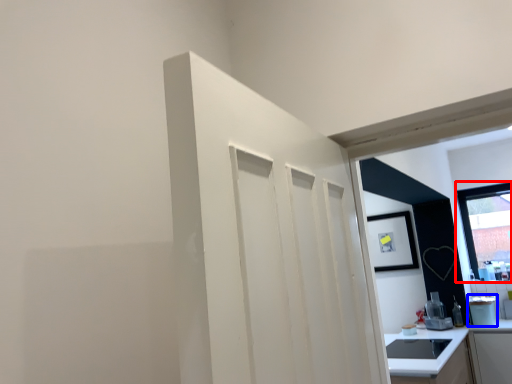
Question: Which of the following is the closest to the observer, window (highlighted by a red box) or appliance (highlighted by a blue box)?

Choices:
 (A) window
 (B) appliance

Answer: (B)